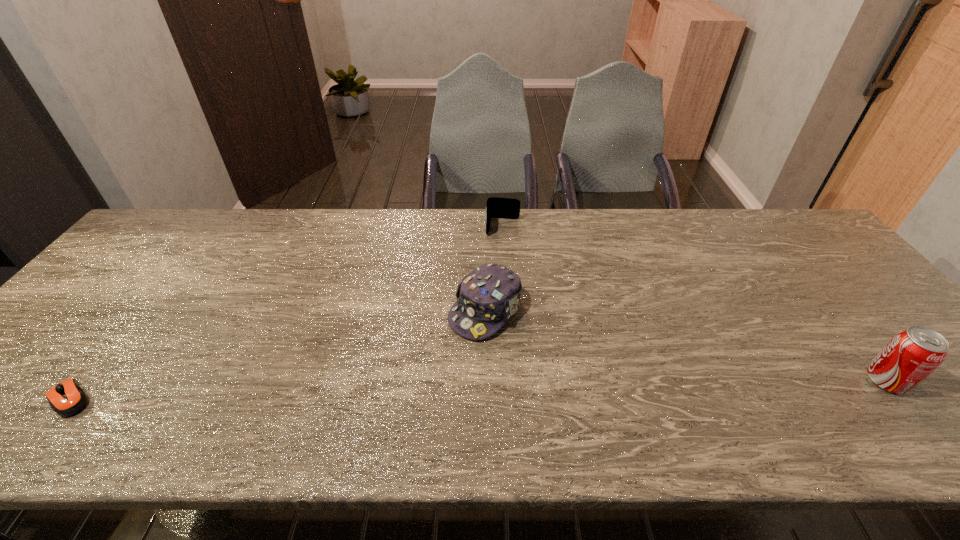
Identify the location of free space on the desktop that is between the computer mouse and the rightmost object and is positioned on the outer surface of the wallet. (492, 389).

I want to click on free spot on the desktop that is between the shortest object and the rightmost object and is positioned on the front-facing side of the second tallest object, so click(409, 391).